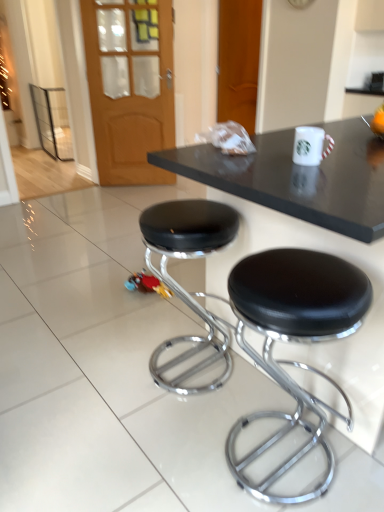
Question: Is black leather stool at lower right, positioned as the second stool in left-to-right order, far from black leather stool at center, the second stool from the right?

Choices:
 (A) yes
 (B) no

Answer: (B)

Question: From a real-world perspective, is black leather stool at lower right, positioned as the second stool in left-to-right order, over black leather stool at center, which ranks as the 1th stool in left-to-right order?

Choices:
 (A) yes
 (B) no

Answer: (A)

Question: Is black leather stool at lower right, the first stool from the right, at the right side of black leather stool at center, the second stool from the right?

Choices:
 (A) yes
 (B) no

Answer: (A)

Question: Does black leather stool at lower right, the first stool from the right, have a lesser width compared to black leather stool at center, which ranks as the 1th stool in left-to-right order?

Choices:
 (A) yes
 (B) no

Answer: (B)

Question: Is black leather stool at center, which ranks as the 1th stool in left-to-right order, at the back of black leather stool at lower right, positioned as the second stool in left-to-right order?

Choices:
 (A) yes
 (B) no

Answer: (B)

Question: Is wooden door at upper left inside or outside of black leather stool at lower right, positioned as the second stool in left-to-right order?

Choices:
 (A) inside
 (B) outside

Answer: (B)

Question: Looking at their shapes, would you say wooden door at upper left is wider or thinner than black leather stool at lower right, positioned as the second stool in left-to-right order?

Choices:
 (A) thin
 (B) wide

Answer: (A)

Question: Is wooden door at upper left in front of or behind black leather stool at lower right, positioned as the second stool in left-to-right order, in the image?

Choices:
 (A) behind
 (B) front

Answer: (A)

Question: Visually, is wooden door at upper left positioned to the left or to the right of black leather stool at lower right, the first stool from the right?

Choices:
 (A) left
 (B) right

Answer: (A)

Question: Considering the positions of black leather stool at center, the second stool from the right, and wooden door at upper center in the image, is black leather stool at center, the second stool from the right, taller or shorter than wooden door at upper center?

Choices:
 (A) short
 (B) tall

Answer: (A)

Question: Is black leather stool at center, which ranks as the 1th stool in left-to-right order, spatially inside wooden door at upper center, or outside of it?

Choices:
 (A) outside
 (B) inside

Answer: (A)

Question: Relative to wooden door at upper center, is black leather stool at center, which ranks as the 1th stool in left-to-right order, in front or behind?

Choices:
 (A) front
 (B) behind

Answer: (A)

Question: From the image's perspective, is black leather stool at center, which ranks as the 1th stool in left-to-right order, above or below wooden door at upper center?

Choices:
 (A) below
 (B) above

Answer: (A)

Question: From a real-world perspective, is black glossy table at center above or below black leather stool at lower right, positioned as the second stool in left-to-right order?

Choices:
 (A) below
 (B) above

Answer: (B)

Question: Is point (340, 208) positioned closer to the camera than point (329, 265)?

Choices:
 (A) closer
 (B) farther

Answer: (A)